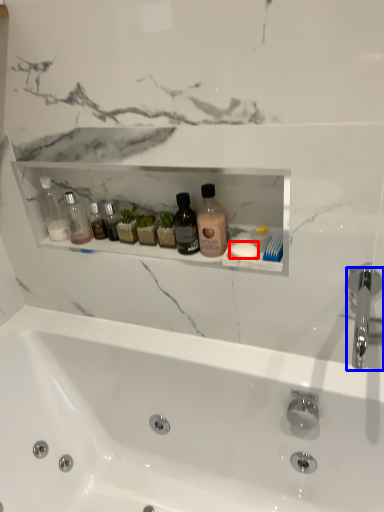
Question: Among these objects, which one is farthest to the camera, soap (highlighted by a red box) or tap (highlighted by a blue box)?

Choices:
 (A) soap
 (B) tap

Answer: (A)